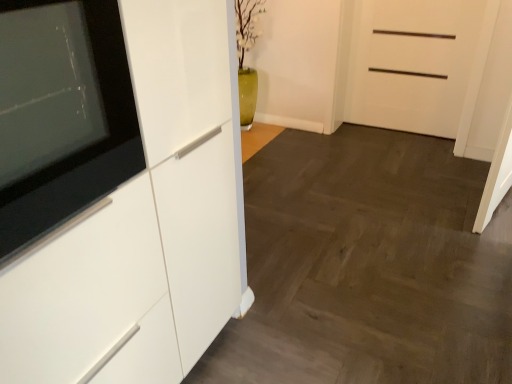
Measure the distance between point (72,142) and camera.

The distance of point (72,142) from camera is 37.99 inches.

The image size is (512, 384). Describe the element at coordinates (412, 63) in the screenshot. I see `white matte door at upper right` at that location.

Where is `black glossy tv at left`? The image size is (512, 384). black glossy tv at left is located at coordinates (62, 113).

Consider the image. Considering the relative sizes of white matte door at upper right and white glossy cabinet at left in the image provided, is white matte door at upper right smaller than white glossy cabinet at left?

Yes, white matte door at upper right is smaller than white glossy cabinet at left.

Considering the relative positions of white matte door at upper right and white glossy cabinet at left in the image provided, is white matte door at upper right to the right of white glossy cabinet at left from the viewer's perspective?

Yes, white matte door at upper right is to the right of white glossy cabinet at left.

Which is closer, (x=464, y=47) or (x=398, y=279)?

Point (x=398, y=279)

How much distance is there between white matte door at upper right and white glossy cabinet at left?

white matte door at upper right and white glossy cabinet at left are 3.73 feet apart from each other.

Does black glossy tv at left lie behind white matte door at upper right?

No, it is not.

Between black glossy tv at left and white matte door at upper right, which one appears on the left side from the viewer's perspective?

black glossy tv at left.

From a real-world perspective, is black glossy tv at left beneath white matte door at upper right?

Incorrect, from a real-world perspective, black glossy tv at left is higher than white matte door at upper right.

Is white matte door at upper right inside the boundaries of black glossy tv at left, or outside?

white matte door at upper right cannot be found inside black glossy tv at left.

Considering the sizes of objects white matte door at upper right and black glossy tv at left in the image provided, who is taller, white matte door at upper right or black glossy tv at left?

white matte door at upper right is taller.

Looking at their sizes, would you say white matte door at upper right is wider or thinner than black glossy tv at left?

Clearly, white matte door at upper right has more width compared to black glossy tv at left.

From a real-world perspective, is white matte door at upper right located higher than black glossy tv at left?

No, from a real-world perspective, white matte door at upper right is not over black glossy tv at left

From a real-world perspective, who is located lower, white glossy cabinet at left or black glossy tv at left?

white glossy cabinet at left, from a real-world perspective.

Is white glossy cabinet at left far away from black glossy tv at left?

Absolutely, white glossy cabinet at left is distant from black glossy tv at left.

How many degrees apart are the facing directions of white glossy cabinet at left and black glossy tv at left?

The angle between the facing direction of white glossy cabinet at left and the facing direction of black glossy tv at left is 0.518 degrees.

Does white glossy cabinet at left have a greater height compared to black glossy tv at left?

No, white glossy cabinet at left is not taller than black glossy tv at left.

Does white glossy cabinet at left have a larger size compared to white matte door at upper right?

Yes.

From a real-world perspective, which object stands above the other?

white matte door at upper right.

Find the location of `door to the right of white glossy cabinet at left`. door to the right of white glossy cabinet at left is located at coordinates (412, 63).

Considering the positions of points (472, 268) and (356, 64), is point (472, 268) farther from camera compared to point (356, 64)?

No.

Is black glossy tv at left aimed at white glossy cabinet at left?

No, black glossy tv at left is not oriented towards white glossy cabinet at left.

From the image's perspective, which is below, black glossy tv at left or white glossy cabinet at left?

white glossy cabinet at left, from the image's perspective.

Considering the relative positions of black glossy tv at left and white glossy cabinet at left in the image provided, is black glossy tv at left to the right of white glossy cabinet at left from the viewer's perspective?

No, black glossy tv at left is not to the right of white glossy cabinet at left.

The height and width of the screenshot is (384, 512). What are the coordinates of `plain located in front of the white matte door at upper right` in the screenshot? It's located at (367, 266).

The image size is (512, 384). I want to click on appliance below the white matte door at upper right (from the image's perspective), so click(x=62, y=113).

Looking at the image, which one is located further to white matte door at upper right, black glossy tv at left or white glossy cabinet at left?

Based on the image, black glossy tv at left appears to be further to white matte door at upper right.

Looking at the image, which one is located closer to white matte door at upper right, white glossy cabinet at left or black glossy tv at left?

white glossy cabinet at left lies closer to white matte door at upper right than the other object.

Estimate the real-world distances between objects in this image. Which object is further from white glossy cabinet at left, black glossy tv at left or white matte door at upper right?

The object further to white glossy cabinet at left is black glossy tv at left.

From the image, which object appears to be farther from black glossy tv at left, white glossy cabinet at left or white matte door at upper right?

Based on the image, white matte door at upper right appears to be further to black glossy tv at left.

From the image, which object appears to be nearer to white glossy cabinet at left, white matte door at upper right or black glossy tv at left?

white matte door at upper right lies closer to white glossy cabinet at left than the other object.

Based on their spatial positions, is white matte door at upper right or white glossy cabinet at left closer to black glossy tv at left?

white glossy cabinet at left.

You are a GUI agent. You are given a task and a screenshot of the screen. Output one action in this format:
    pyautogui.click(x=<x>, y=<y>)
    Task: Click on the plain positioned between black glossy tv at left and white matte door at upper right from near to far
    The image size is (512, 384).
    Given the screenshot: What is the action you would take?
    pyautogui.click(x=367, y=266)